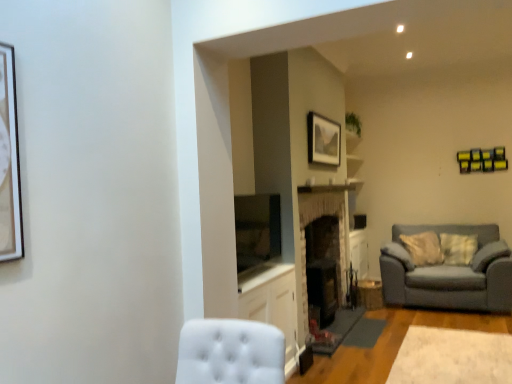
Question: Can you confirm if white plush rug at lower right is wider than matte wooden picture frame at upper center?

Choices:
 (A) yes
 (B) no

Answer: (A)

Question: Is white plush rug at lower right turned away from matte wooden picture frame at upper center?

Choices:
 (A) yes
 (B) no

Answer: (B)

Question: Is white plush rug at lower right taller than matte wooden picture frame at upper center?

Choices:
 (A) yes
 (B) no

Answer: (B)

Question: Is white plush rug at lower right shorter than matte wooden picture frame at upper center?

Choices:
 (A) no
 (B) yes

Answer: (B)

Question: Is white plush rug at lower right positioned before matte wooden picture frame at upper center?

Choices:
 (A) no
 (B) yes

Answer: (B)

Question: In the image, is matte wooden picture frame at upper center positioned in front of or behind gray fabric couch at right?

Choices:
 (A) front
 (B) behind

Answer: (A)

Question: Is matte wooden picture frame at upper center to the left or to the right of gray fabric couch at right in the image?

Choices:
 (A) right
 (B) left

Answer: (B)

Question: From a real-world perspective, is matte wooden picture frame at upper center positioned above or below gray fabric couch at right?

Choices:
 (A) below
 (B) above

Answer: (B)

Question: Is point (338, 145) positioned closer to the camera than point (385, 292)?

Choices:
 (A) farther
 (B) closer

Answer: (B)

Question: Is white glossy cabinet at center to the left or to the right of gray fabric couch at right in the image?

Choices:
 (A) left
 (B) right

Answer: (A)

Question: Based on their sizes in the image, would you say white glossy cabinet at center is bigger or smaller than gray fabric couch at right?

Choices:
 (A) big
 (B) small

Answer: (B)

Question: From a real-world perspective, is white glossy cabinet at center above or below gray fabric couch at right?

Choices:
 (A) below
 (B) above

Answer: (A)

Question: Considering the positions of point (270, 304) and point (456, 288), is point (270, 304) closer or farther from the camera than point (456, 288)?

Choices:
 (A) farther
 (B) closer

Answer: (B)

Question: From their relative heights in the image, would you say white plush rug at lower right is taller or shorter than matte wooden picture frame at upper center?

Choices:
 (A) tall
 (B) short

Answer: (B)

Question: Would you say white plush rug at lower right is inside or outside matte wooden picture frame at upper center?

Choices:
 (A) inside
 (B) outside

Answer: (B)